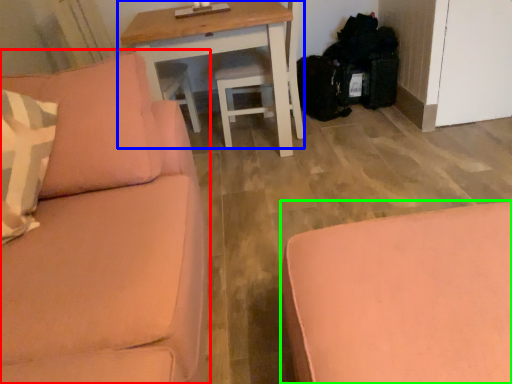
Question: Considering the real-world distances, which object is farthest from studio couch (highlighted by a red box)? table (highlighted by a blue box) or studio couch (highlighted by a green box)?

Choices:
 (A) table
 (B) studio couch

Answer: (A)